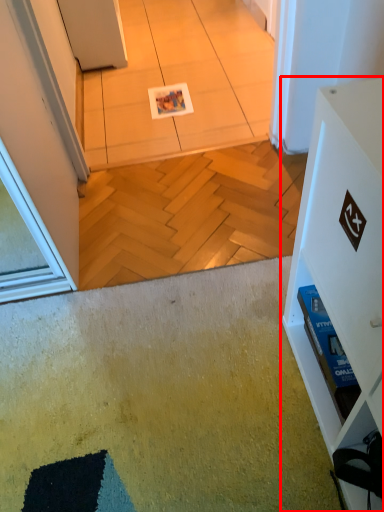
Question: From the image, what is the correct spatial relationship of furniture (annotated by the red box) in relation to tile?

Choices:
 (A) left
 (B) right

Answer: (B)